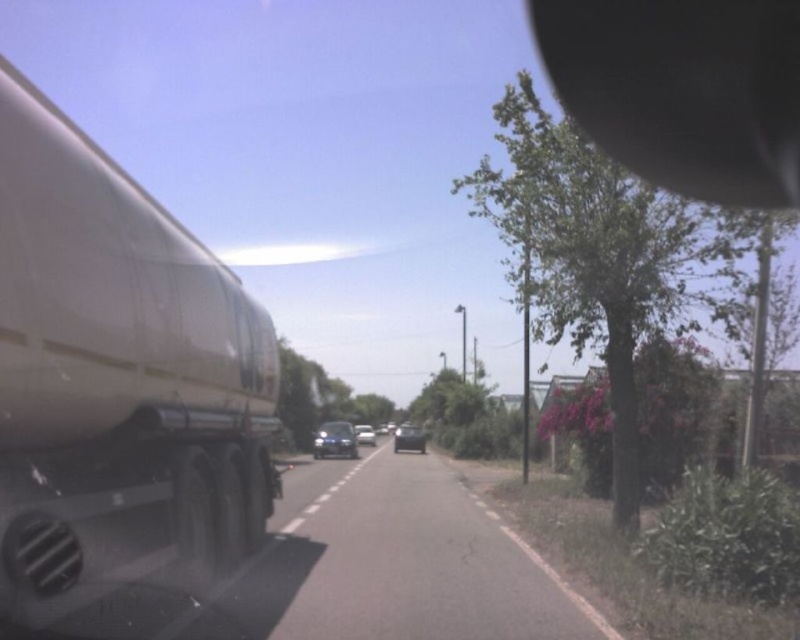
Consider the image. Measure the distance between point [272,380] and camera.

The distance of point [272,380] from camera is 11.01 meters.

Does matte white trailer truck at left appear on the left side of black rubber view mirror at upper right?

Indeed, matte white trailer truck at left is positioned on the left side of black rubber view mirror at upper right.

Image resolution: width=800 pixels, height=640 pixels. What do you see at coordinates (117, 378) in the screenshot?
I see `matte white trailer truck at left` at bounding box center [117, 378].

Where is `matte white trailer truck at left`? matte white trailer truck at left is located at coordinates [x=117, y=378].

Does black rubber view mirror at upper right have a lesser height compared to shiny blue sedan at center?

No, black rubber view mirror at upper right is not shorter than shiny blue sedan at center.

Can you confirm if black rubber view mirror at upper right is positioned above shiny blue sedan at center?

Correct, black rubber view mirror at upper right is located above shiny blue sedan at center.

Locate an element on the screen. This screenshot has height=640, width=800. black rubber view mirror at upper right is located at coordinates (684, 90).

Can you confirm if matte white trailer truck at left is shorter than shiny black sedan at center?

Indeed, matte white trailer truck at left has a lesser height compared to shiny black sedan at center.

Who is taller, matte white trailer truck at left or shiny black sedan at center?

shiny black sedan at center is taller.

Is point (81, 449) farther from viewer compared to point (414, 429)?

No, (81, 449) is closer to viewer.

Find the location of a particular element. This screenshot has height=640, width=800. matte white trailer truck at left is located at coordinates (117, 378).